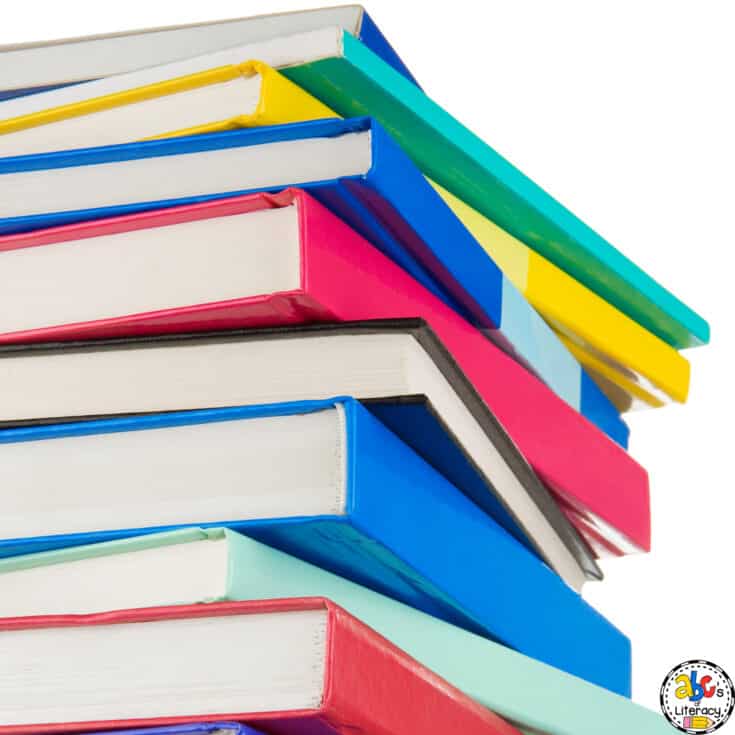
I want to click on hardcover books, so click(376, 39), click(367, 81), click(273, 96), click(383, 178), click(323, 273), click(370, 356), click(283, 462), click(207, 569), click(242, 655), click(225, 724).